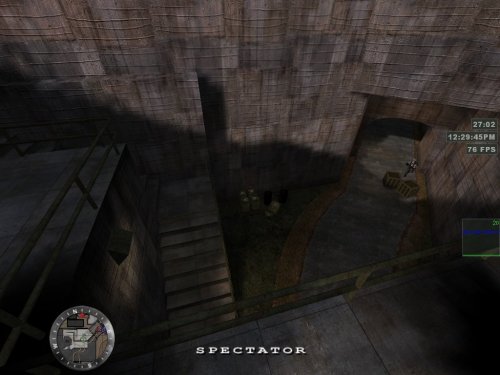
This screenshot has height=375, width=500. I want to click on industrial wall light, so click(x=122, y=245).